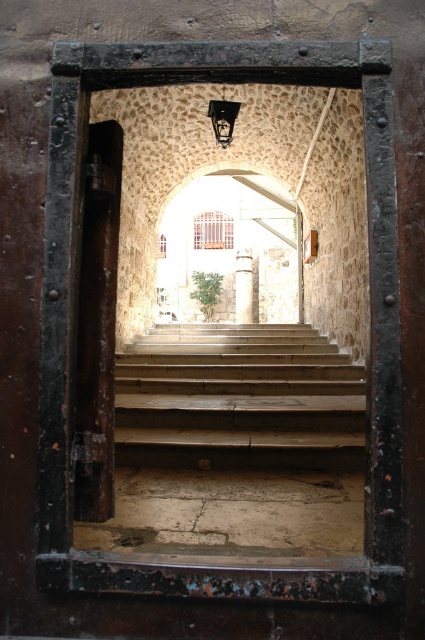
You are a delivery person carrying a large package that is 1.5 meters wide. You need to enter through the doorway and place the package on the wooden stairs at center. Can the package fit through the doorway without touching the rusty metal door at left?

The wooden stairs at center is bigger than the rusty metal door at left, but the question is about the width of the doorway. Since the description does not provide the exact width of the doorway or the distance between the door and the stairs, we cannot determine if the 1.5 meter wide package can fit through the doorway. More information is needed about the doorway dimensions.

You are a delivery person carrying a large package and need to enter the corridor through the doorway. You see the wooden stairs at center and the rusty metal door at left. Which object is on the right side of the other?

The wooden stairs at center is positioned on the right side of the rusty metal door at left, so the wooden stairs at center is on the right side of the rusty metal door at left.